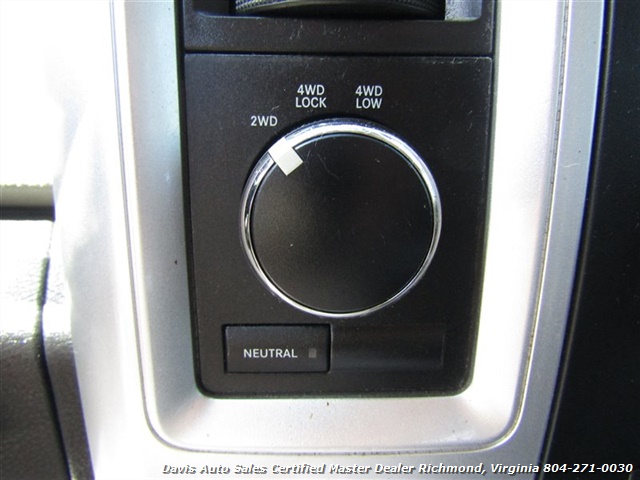
Locate an element on the screen. This screenshot has width=640, height=480. knob is located at coordinates (344, 236).